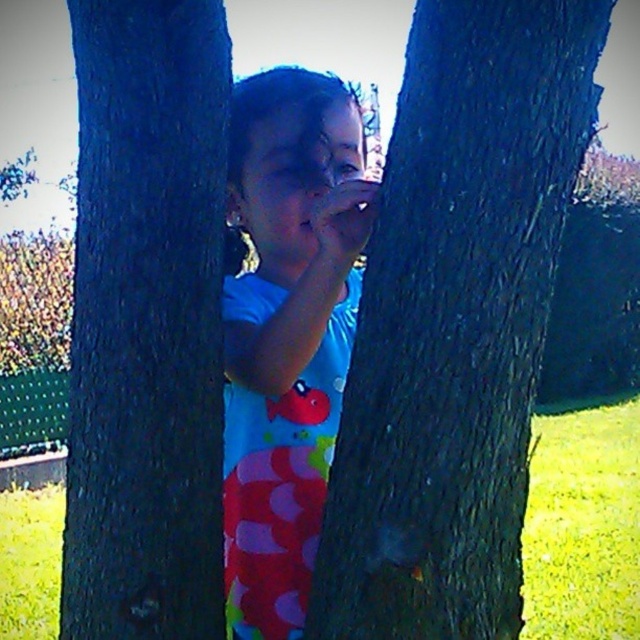
Question: Is smooth bark tree trunk at center bigger than blue fabric at center?

Choices:
 (A) no
 (B) yes

Answer: (A)

Question: Which point is farther from the camera taking this photo?

Choices:
 (A) (348, 442)
 (B) (164, 282)

Answer: (B)

Question: Among these objects, which one is farthest from the camera?

Choices:
 (A) dark brown rough tree trunk at center
 (B) blue fabric at center
 (C) smooth bark tree trunk at center

Answer: (B)

Question: Can you confirm if dark brown rough tree trunk at center is positioned below blue fabric at center?

Choices:
 (A) yes
 (B) no

Answer: (A)

Question: Is smooth bark tree trunk at center to the left of blue fabric at center from the viewer's perspective?

Choices:
 (A) yes
 (B) no

Answer: (B)

Question: Which is farther from the smooth bark tree trunk at center?

Choices:
 (A) dark brown rough tree trunk at center
 (B) blue fabric at center

Answer: (A)